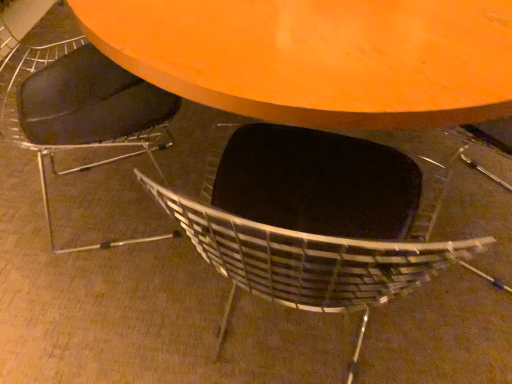
Question: From the image's perspective, is matte black chair at lower center, the 2th chair in the right-to-left sequence, on black leather chair at center, which is counted as the second chair, starting from the left?

Choices:
 (A) yes
 (B) no

Answer: (A)

Question: Does matte black chair at lower center, the 2th chair in the right-to-left sequence, have a larger size compared to black leather chair at center, the first chair in the right-to-left sequence?

Choices:
 (A) yes
 (B) no

Answer: (B)

Question: Is matte black chair at lower center, the 2th chair in the right-to-left sequence, behind black leather chair at center, which is counted as the second chair, starting from the left?

Choices:
 (A) no
 (B) yes

Answer: (B)

Question: Is black leather chair at center, which is counted as the second chair, starting from the left, inside matte black chair at lower center, placed as the 1th chair when sorted from left to right?

Choices:
 (A) yes
 (B) no

Answer: (B)

Question: Is matte black chair at lower center, the 2th chair in the right-to-left sequence, wider than black leather chair at center, which is counted as the second chair, starting from the left?

Choices:
 (A) no
 (B) yes

Answer: (A)

Question: Is the depth of black leather chair at center, the first chair in the right-to-left sequence, greater than that of matte black chair at lower center, the 2th chair in the right-to-left sequence?

Choices:
 (A) yes
 (B) no

Answer: (B)

Question: Is black leather chair at center, which is counted as the second chair, starting from the left, wider than matte black chair at lower center, placed as the 1th chair when sorted from left to right?

Choices:
 (A) yes
 (B) no

Answer: (A)

Question: Is black leather chair at center, the first chair in the right-to-left sequence, to the left of matte black chair at lower center, placed as the 1th chair when sorted from left to right, from the viewer's perspective?

Choices:
 (A) no
 (B) yes

Answer: (A)

Question: From the image's perspective, is black leather chair at center, the first chair in the right-to-left sequence, under matte black chair at lower center, the 2th chair in the right-to-left sequence?

Choices:
 (A) no
 (B) yes

Answer: (B)

Question: Considering the relative positions of black leather chair at center, which is counted as the second chair, starting from the left, and matte black chair at lower center, the 2th chair in the right-to-left sequence, in the image provided, is black leather chair at center, which is counted as the second chair, starting from the left, to the right of matte black chair at lower center, the 2th chair in the right-to-left sequence, from the viewer's perspective?

Choices:
 (A) no
 (B) yes

Answer: (B)

Question: Does black leather chair at center, which is counted as the second chair, starting from the left, have a lesser width compared to matte black chair at lower center, the 2th chair in the right-to-left sequence?

Choices:
 (A) yes
 (B) no

Answer: (B)

Question: From a real-world perspective, is matte black chair at lower center, the 2th chair in the right-to-left sequence, above or below black leather chair at center, which is counted as the second chair, starting from the left?

Choices:
 (A) above
 (B) below

Answer: (A)